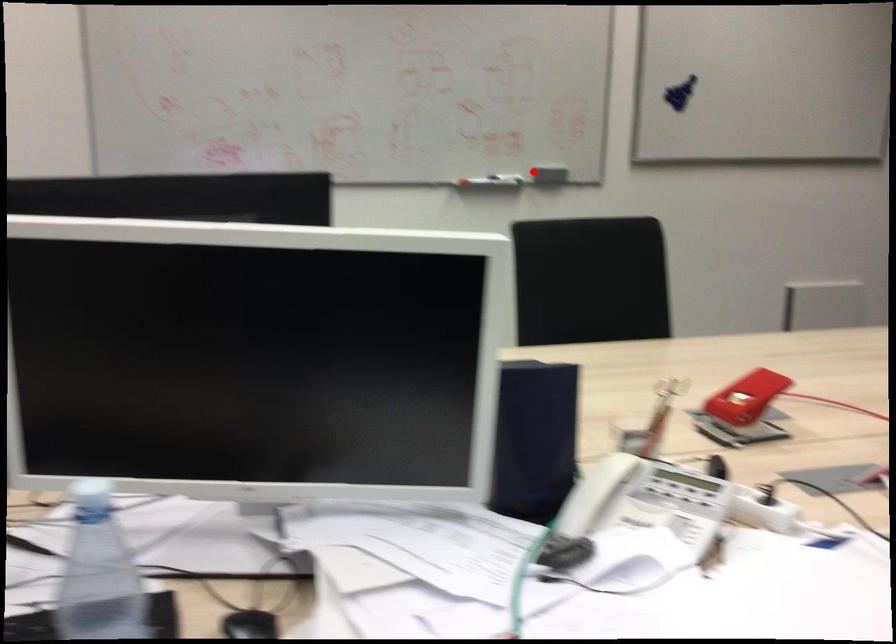
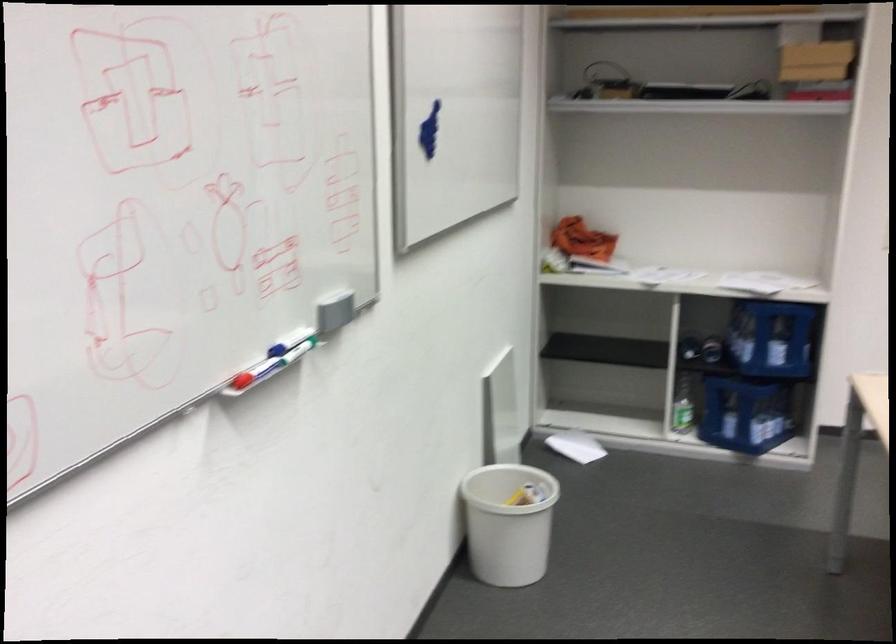
Question: I am providing you with two images of the same scene from different viewpoints. Image1 has a red point marked. In image2, the corresponding 3D location appears at what relative position? Reply with the corresponding letter.

Choices:
 (A) Closer
 (B) Farther

Answer: (A)